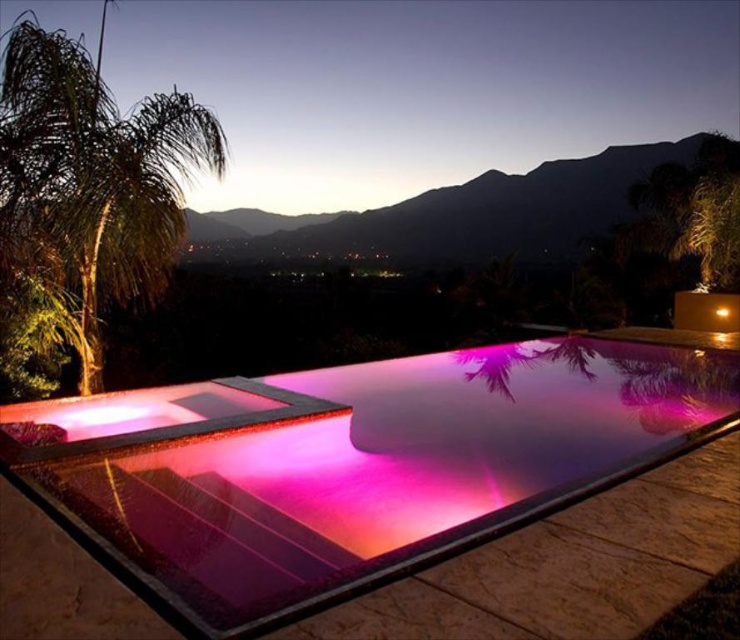
Question: Among these points, which one is farthest from the camera?

Choices:
 (A) click(158, 292)
 (B) click(652, 344)

Answer: (B)

Question: Can you confirm if purple glass pool at center is wider than green leafy palm tree at left?

Choices:
 (A) yes
 (B) no

Answer: (B)

Question: Which point is farther to the camera?

Choices:
 (A) (3, 157)
 (B) (397, 448)

Answer: (A)

Question: Is the position of purple glass pool at center more distant than that of green leafy palm tree at left?

Choices:
 (A) yes
 (B) no

Answer: (B)

Question: Can you confirm if purple glass pool at center is positioned to the left of green leafy palm tree at left?

Choices:
 (A) yes
 (B) no

Answer: (B)

Question: Which point is closer to the camera?

Choices:
 (A) purple glass pool at center
 (B) green leafy palm tree at left

Answer: (A)